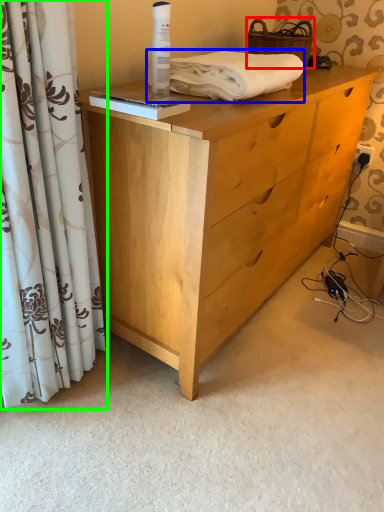
Question: Which object is positioned closest to basket (highlighted by a red box)? Select from bath towel (highlighted by a blue box) and curtain (highlighted by a green box).

Choices:
 (A) bath towel
 (B) curtain

Answer: (A)